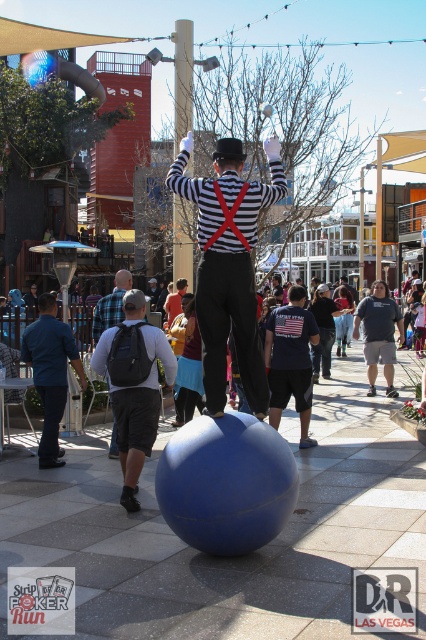
Which is more to the left, black backpack at center or blue denim shirt at lower left?

blue denim shirt at lower left is more to the left.

Between black backpack at center and blue denim shirt at lower left, which one has less height?

blue denim shirt at lower left

Does point (135, 381) come closer to viewer compared to point (57, 353)?

Yes, it is.

This screenshot has width=426, height=640. I want to click on black backpack at center, so click(135, 392).

This screenshot has width=426, height=640. What do you see at coordinates (229, 264) in the screenshot?
I see `striped fabric magician at center` at bounding box center [229, 264].

Does point (241, 269) lie in front of point (94, 317)?

Yes, it is in front of point (94, 317).

Identify the location of striped fabric magician at center. This screenshot has width=426, height=640. (229, 264).

Is striped fabric magician at center to the left of black backpack at center from the viewer's perspective?

In fact, striped fabric magician at center is to the right of black backpack at center.

Is striped fabric magician at center bigger than black backpack at center?

Correct, striped fabric magician at center is larger in size than black backpack at center.

You are a GUI agent. You are given a task and a screenshot of the screen. Output one action in this format:
    pyautogui.click(x=<x>, y=<y>)
    Task: Click on the striped fabric magician at center
    
    Given the screenshot: What is the action you would take?
    pyautogui.click(x=229, y=264)

Image resolution: width=426 pixels, height=640 pixels. I want to click on striped fabric magician at center, so click(229, 264).